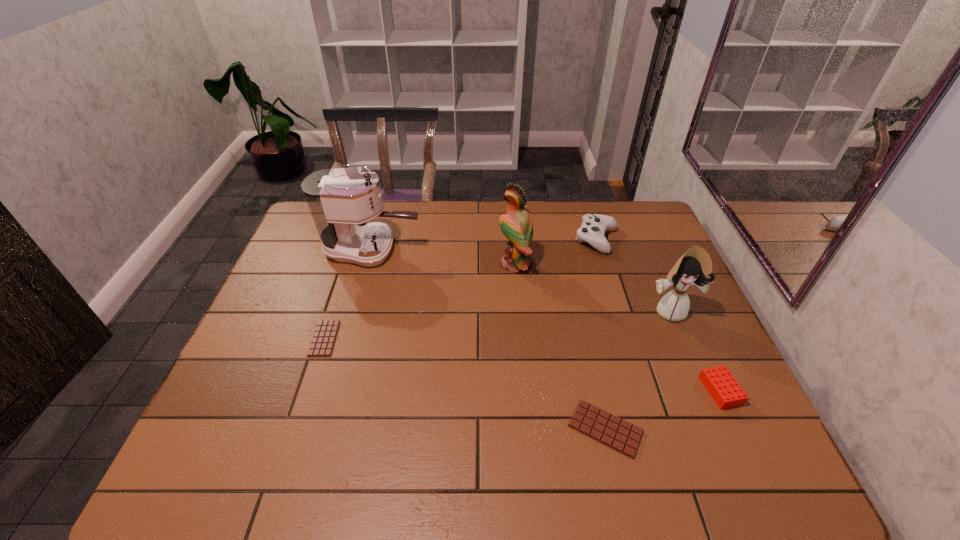
This screenshot has width=960, height=540. What are the coordinates of `free space located on the back of the nearer candy bar` in the screenshot? It's located at (590, 362).

You are a GUI agent. You are given a task and a screenshot of the screen. Output one action in this format:
    pyautogui.click(x=<x>, y=<y>)
    Task: Click on the free region located 0.120m on the back of the control
    The height and width of the screenshot is (540, 960).
    Given the screenshot: What is the action you would take?
    pyautogui.click(x=587, y=205)

The width and height of the screenshot is (960, 540). What are the coordinates of `free spot located on the front-facing side of the parrot` in the screenshot? It's located at (450, 264).

Where is `free region located on the front-facing side of the parrot`? free region located on the front-facing side of the parrot is located at coordinates (391, 264).

Locate an element on the screen. Image resolution: width=960 pixels, height=540 pixels. blank area located 0.150m on the front-facing side of the parrot is located at coordinates (450, 264).

Where is `vacant space located on the front-facing side of the coffee maker`? This screenshot has width=960, height=540. vacant space located on the front-facing side of the coffee maker is located at coordinates (494, 249).

This screenshot has width=960, height=540. What are the coordinates of `vacant area situated 0.290m at the front face of the doll` in the screenshot? It's located at (717, 420).

This screenshot has height=540, width=960. I want to click on free space located on the left of the Lego, so click(x=616, y=390).

You are a GUI agent. You are given a task and a screenshot of the screen. Output one action in this format:
    pyautogui.click(x=<x>, y=<y>)
    Task: Click on the control present at the far edge
    Image resolution: width=960 pixels, height=540 pixels.
    Given the screenshot: What is the action you would take?
    pyautogui.click(x=594, y=226)

You are a GUI agent. You are given a task and a screenshot of the screen. Output one action in this format:
    pyautogui.click(x=<x>, y=<y>)
    Task: Click on the coffee maker that is at the far edge
    The width and height of the screenshot is (960, 540).
    Given the screenshot: What is the action you would take?
    pyautogui.click(x=341, y=201)